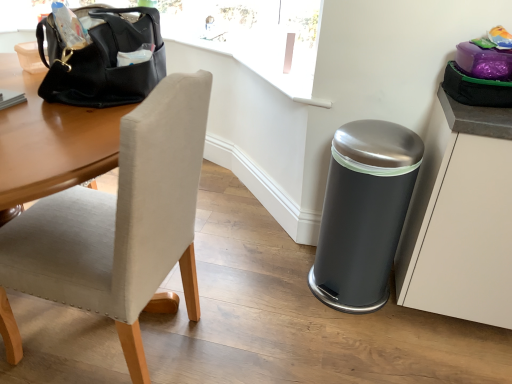
Describe the element at coordinates (122, 221) in the screenshot. The height and width of the screenshot is (384, 512). I see `beige fabric chair at left` at that location.

The width and height of the screenshot is (512, 384). What do you see at coordinates (103, 60) in the screenshot?
I see `black leather handbag at upper left` at bounding box center [103, 60].

Locate an element on the screen. Image resolution: width=512 pixels, height=384 pixels. beige fabric chair at left is located at coordinates (122, 221).

From the picture: From a real-world perspective, is white matte cabinet at right beneath black leather handbag at upper left?

Yes, from a real-world perspective, white matte cabinet at right is below black leather handbag at upper left.

Is white matte cabinet at right positioned with its back to black leather handbag at upper left?

No, white matte cabinet at right is not facing away from black leather handbag at upper left.

Considering the sizes of objects white matte cabinet at right and black leather handbag at upper left in the image provided, who is wider, white matte cabinet at right or black leather handbag at upper left?

white matte cabinet at right is wider.

Which is behind, black leather handbag at upper left or satin silver trash can at lower right?

satin silver trash can at lower right is further from the camera.

Is black leather handbag at upper left not within satin silver trash can at lower right?

That's correct, black leather handbag at upper left is outside of satin silver trash can at lower right.

In the scene shown: Are black leather handbag at upper left and satin silver trash can at lower right located far from each other?

No, black leather handbag at upper left is not far away from satin silver trash can at lower right.

Identify the location of handbag above the satin silver trash can at lower right (from a real-world perspective). (103, 60).

Is beige fabric chair at left in front of or behind satin silver trash can at lower right in the image?

beige fabric chair at left is in front of satin silver trash can at lower right.

Considering the relative positions of beige fabric chair at left and satin silver trash can at lower right in the image provided, is beige fabric chair at left to the left or to the right of satin silver trash can at lower right?

Based on their positions, beige fabric chair at left is located to the left of satin silver trash can at lower right.

In the scene shown: From a real-world perspective, is beige fabric chair at left below satin silver trash can at lower right?

No, from a real-world perspective, beige fabric chair at left is not under satin silver trash can at lower right.

Is satin silver trash can at lower right in front of or behind black leather handbag at upper left in the image?

Clearly, satin silver trash can at lower right is behind black leather handbag at upper left.

Find the location of a particular element. handbag in front of the satin silver trash can at lower right is located at coordinates (103, 60).

Considering the sizes of satin silver trash can at lower right and black leather handbag at upper left in the image, is satin silver trash can at lower right wider or thinner than black leather handbag at upper left?

In the image, satin silver trash can at lower right appears to be wider than black leather handbag at upper left.

Which is farther from the camera, (374, 229) or (141, 33)?

Positioned behind is point (374, 229).

Could you tell me if black leather handbag at upper left is turned towards white matte cabinet at right?

No.

Which is closer to the camera, [112,9] or [504,261]?

Point [112,9]

Is black leather handbag at upper left situated inside white matte cabinet at right or outside?

black leather handbag at upper left lies outside white matte cabinet at right.

Is black leather handbag at upper left at the left side of white matte cabinet at right?

Yes.

I want to click on chair below the white matte cabinet at right (from the image's perspective), so click(x=122, y=221).

Considering the positions of objects beige fabric chair at left and white matte cabinet at right in the image provided, who is in front, beige fabric chair at left or white matte cabinet at right?

beige fabric chair at left is closer to the camera.

Who is smaller, beige fabric chair at left or white matte cabinet at right?

Smaller between the two is white matte cabinet at right.

From the picture: From a real-world perspective, does satin silver trash can at lower right sit lower than beige fabric chair at left?

Yes, from a real-world perspective, satin silver trash can at lower right is beneath beige fabric chair at left.

What's the angular difference between satin silver trash can at lower right and beige fabric chair at left's facing directions?

93.9 degrees.

Looking at this image, which of these two, satin silver trash can at lower right or beige fabric chair at left, is thinner?

satin silver trash can at lower right is thinner.

Which is more to the left, satin silver trash can at lower right or beige fabric chair at left?

From the viewer's perspective, beige fabric chair at left appears more on the left side.

The width and height of the screenshot is (512, 384). What are the coordinates of `handbag above the white matte cabinet at right (from the image's perspective)` in the screenshot? It's located at (103, 60).

Find the location of a particular element. Image resolution: width=512 pixels, height=384 pixels. trash bin/can that appears on the right of black leather handbag at upper left is located at coordinates (364, 213).

From the image, which object appears to be nearer to black leather handbag at upper left, beige fabric chair at left or satin silver trash can at lower right?

Among the two, beige fabric chair at left is located nearer to black leather handbag at upper left.

Based on their spatial positions, is white matte cabinet at right or beige fabric chair at left closer to satin silver trash can at lower right?

white matte cabinet at right is closer to satin silver trash can at lower right.

Looking at the image, which one is located further to white matte cabinet at right, black leather handbag at upper left or satin silver trash can at lower right?

black leather handbag at upper left lies further to white matte cabinet at right than the other object.

When comparing their distances from beige fabric chair at left, does satin silver trash can at lower right or black leather handbag at upper left seem closer?

black leather handbag at upper left.

Considering their positions, is white matte cabinet at right positioned further to satin silver trash can at lower right than black leather handbag at upper left?

black leather handbag at upper left is further to satin silver trash can at lower right.

Considering their positions, is beige fabric chair at left positioned closer to white matte cabinet at right than black leather handbag at upper left?

beige fabric chair at left is positioned closer to the anchor white matte cabinet at right.

Considering their positions, is black leather handbag at upper left positioned closer to satin silver trash can at lower right than white matte cabinet at right?

white matte cabinet at right.

Based on their spatial positions, is white matte cabinet at right or beige fabric chair at left closer to black leather handbag at upper left?

beige fabric chair at left.

At what (x,y) coordinates should I click in order to perform the action: click on chair located between black leather handbag at upper left and satin silver trash can at lower right in the left-right direction. Please return your answer as a coordinate pair (x, y). Image resolution: width=512 pixels, height=384 pixels. Looking at the image, I should click on (122, 221).

Locate an element on the screen. The width and height of the screenshot is (512, 384). chair between black leather handbag at upper left and white matte cabinet at right in the horizontal direction is located at coordinates (122, 221).

This screenshot has height=384, width=512. I want to click on trash bin/can situated between beige fabric chair at left and white matte cabinet at right from left to right, so click(x=364, y=213).

Identify the location of trash bin/can between black leather handbag at upper left and white matte cabinet at right. This screenshot has height=384, width=512. (364, 213).